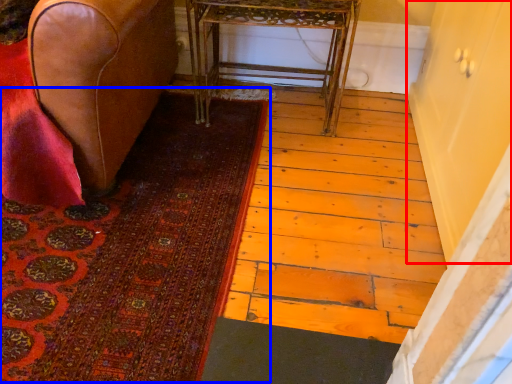
Question: Which of the following is the farthest to the observer, screen door (highlighted by a red box) or mat (highlighted by a blue box)?

Choices:
 (A) screen door
 (B) mat

Answer: (B)